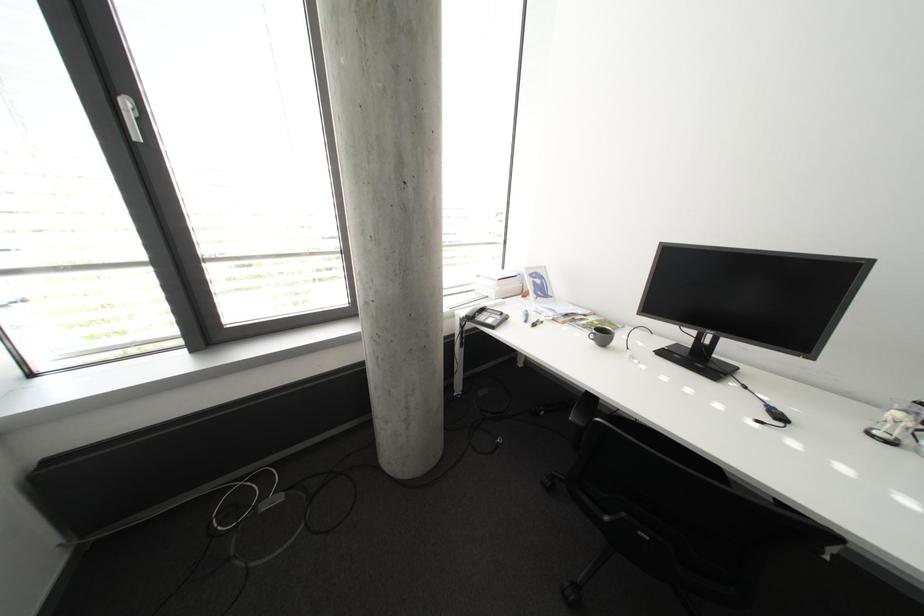
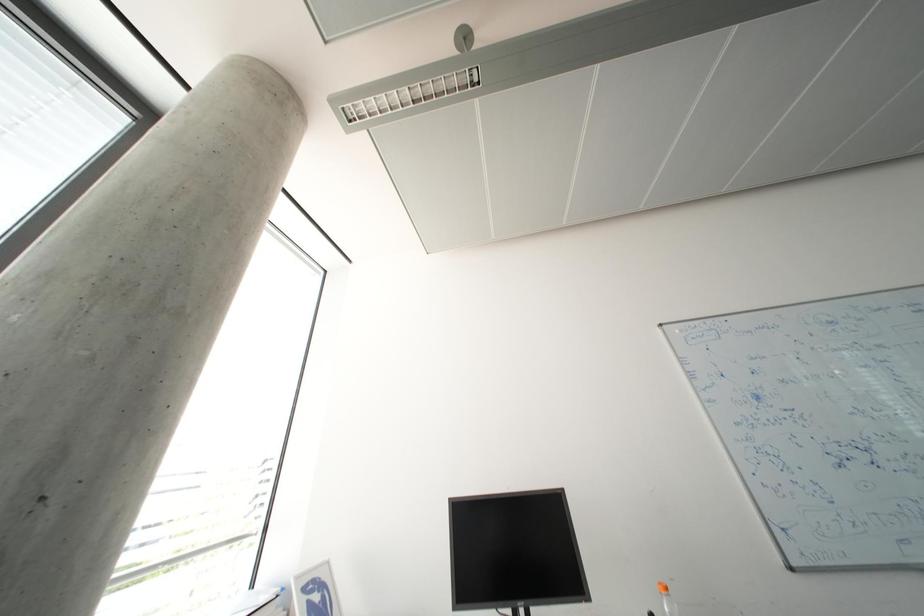
From the picture: First-person continuous shooting, in which direction is the camera rotating?

The camera's rotation is toward right-up.